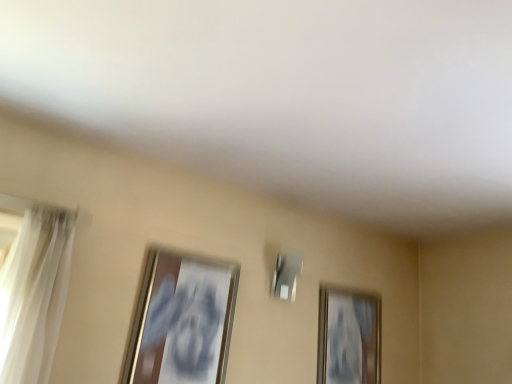
Question: Is gold metallic picture frame at upper right, the second picture frame positioned from the front, behind white sheer curtain at left?

Choices:
 (A) no
 (B) yes

Answer: (B)

Question: Is gold metallic picture frame at upper right, placed as the 1th picture frame when sorted from back to front, at the right side of white sheer curtain at left?

Choices:
 (A) yes
 (B) no

Answer: (A)

Question: Is gold metallic picture frame at upper right, which appears as the 1th picture frame when viewed from the right, turned away from white sheer curtain at left?

Choices:
 (A) yes
 (B) no

Answer: (B)

Question: From the image's perspective, is gold metallic picture frame at upper right, which appears as the 1th picture frame when viewed from the right, beneath white sheer curtain at left?

Choices:
 (A) no
 (B) yes

Answer: (B)

Question: Is gold metallic picture frame at upper right, the 2th picture frame viewed from the left, bigger than white sheer curtain at left?

Choices:
 (A) yes
 (B) no

Answer: (B)

Question: Is point (59, 261) positioned closer to the camera than point (377, 306)?

Choices:
 (A) farther
 (B) closer

Answer: (B)

Question: Based on their sizes in the image, would you say white sheer curtain at left is bigger or smaller than gold metallic picture frame at upper right, the second picture frame positioned from the front?

Choices:
 (A) small
 (B) big

Answer: (B)

Question: Which is correct: white sheer curtain at left is inside gold metallic picture frame at upper right, the second picture frame positioned from the front, or outside of it?

Choices:
 (A) inside
 (B) outside

Answer: (B)

Question: Relative to gold metallic picture frame at upper right, the 2th picture frame viewed from the left, is white sheer curtain at left in front or behind?

Choices:
 (A) behind
 (B) front

Answer: (B)

Question: Is gold metallic picture frame at upper right, placed as the 1th picture frame when sorted from back to front, in front of or behind white sheer curtain at left in the image?

Choices:
 (A) behind
 (B) front

Answer: (A)

Question: From the image's perspective, is gold metallic picture frame at upper right, the second picture frame positioned from the front, above or below white sheer curtain at left?

Choices:
 (A) below
 (B) above

Answer: (A)

Question: From a real-world perspective, is gold metallic picture frame at upper right, the second picture frame positioned from the front, above or below white sheer curtain at left?

Choices:
 (A) below
 (B) above

Answer: (B)

Question: Is gold metallic picture frame at upper right, the second picture frame positioned from the front, wider or thinner than white sheer curtain at left?

Choices:
 (A) thin
 (B) wide

Answer: (A)

Question: Is metallic silver picture frame at left, the 2th picture frame from the right, spatially inside white sheer curtain at left, or outside of it?

Choices:
 (A) inside
 (B) outside

Answer: (B)

Question: From the image's perspective, relative to white sheer curtain at left, is metallic silver picture frame at left, the 2th picture frame from the back, above or below?

Choices:
 (A) below
 (B) above

Answer: (A)